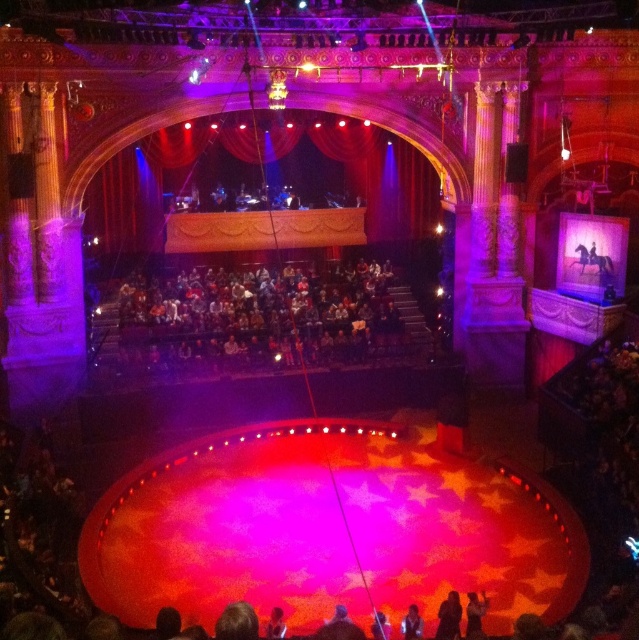
From the picture: You are a stagehand preparing to place a new spotlight. You need to position it so it shines on the silhouette fabric person at lower center without lighting up the dark gray fabric crowd at center. Based on their positions, which direction should you aim the spotlight?

Since the dark gray fabric crowd at center is to the left of the silhouette fabric person at lower center, you should aim the spotlight to the right of the silhouette fabric person at lower center to avoid lighting the crowd.

You are a stagehand in the circus and need to hang a banner between the red velvet curtain at upper center and the dark brown leather jacket at lower center. Can you hang it vertically between them?

The red velvet curtain at upper center is above the dark brown leather jacket at lower center, so yes, you can hang the banner vertically between them since the curtain is positioned higher than the jacket.